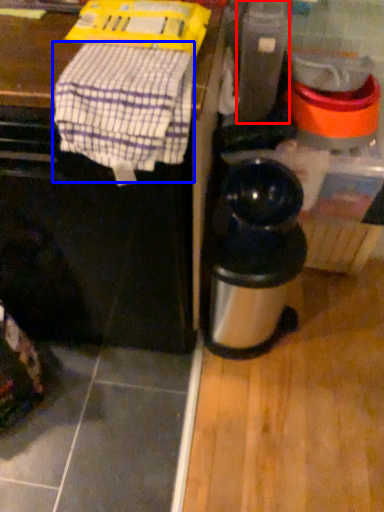
Question: Which of the following is the closest to the observer, appliance (highlighted by a red box) or blanket (highlighted by a blue box)?

Choices:
 (A) appliance
 (B) blanket

Answer: (B)